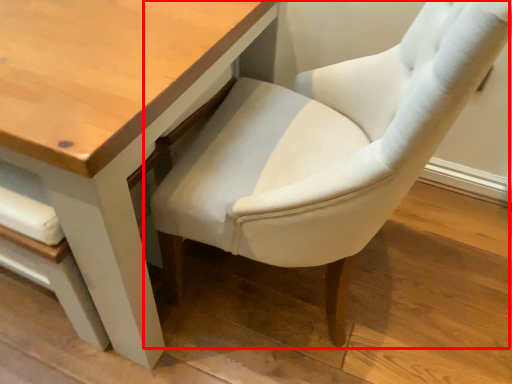
Question: From the image's perspective, considering the relative positions of chair (annotated by the red box) and table in the image provided, where is chair (annotated by the red box) located with respect to the staircase?

Choices:
 (A) above
 (B) below

Answer: (B)